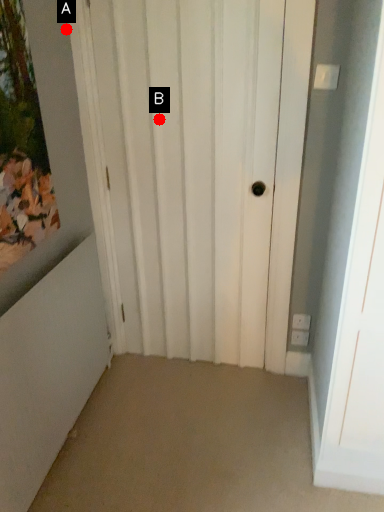
Question: Two points are circled on the image, labeled by A and B beside each circle. Which point is closer to the camera taking this photo?

Choices:
 (A) A is closer
 (B) B is closer

Answer: (A)